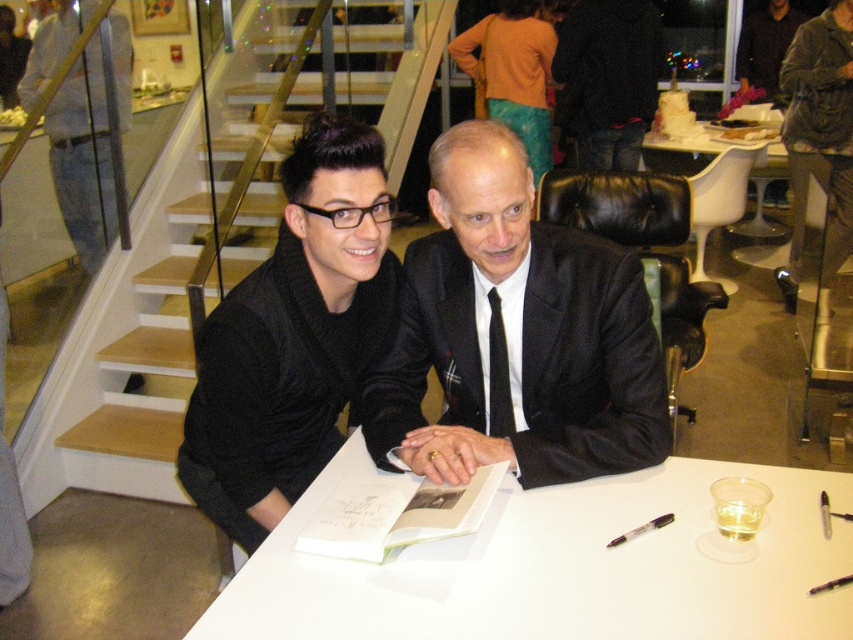
Question: Does white matte table at center appear on the right side of black silk suit at center?

Choices:
 (A) no
 (B) yes

Answer: (B)

Question: Which point is closer to the camera taking this photo?

Choices:
 (A) (639, 531)
 (B) (816, 636)
 (C) (235, 540)

Answer: (B)

Question: Which of the following is the farthest from the observer?

Choices:
 (A) (646, 509)
 (B) (553, 468)
 (C) (225, 298)

Answer: (B)

Question: Is black matte suit at center positioned behind black plastic pen at lower right?

Choices:
 (A) yes
 (B) no

Answer: (A)

Question: Does black matte suit at center appear under black silk suit at center?

Choices:
 (A) no
 (B) yes

Answer: (A)

Question: Which object is farther from the camera taking this photo?

Choices:
 (A) black matte suit at center
 (B) black silk suit at center
 (C) black plastic pen at lower right

Answer: (B)